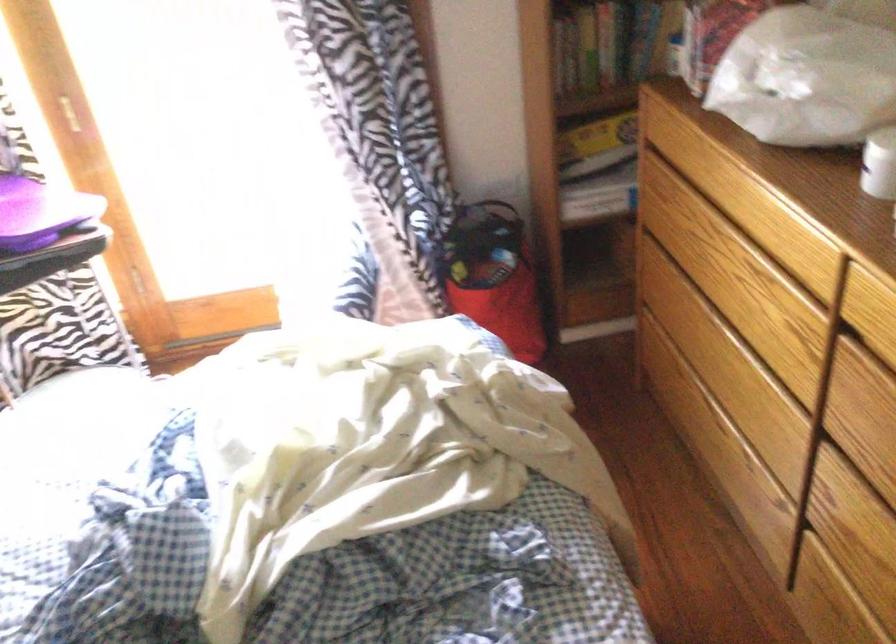
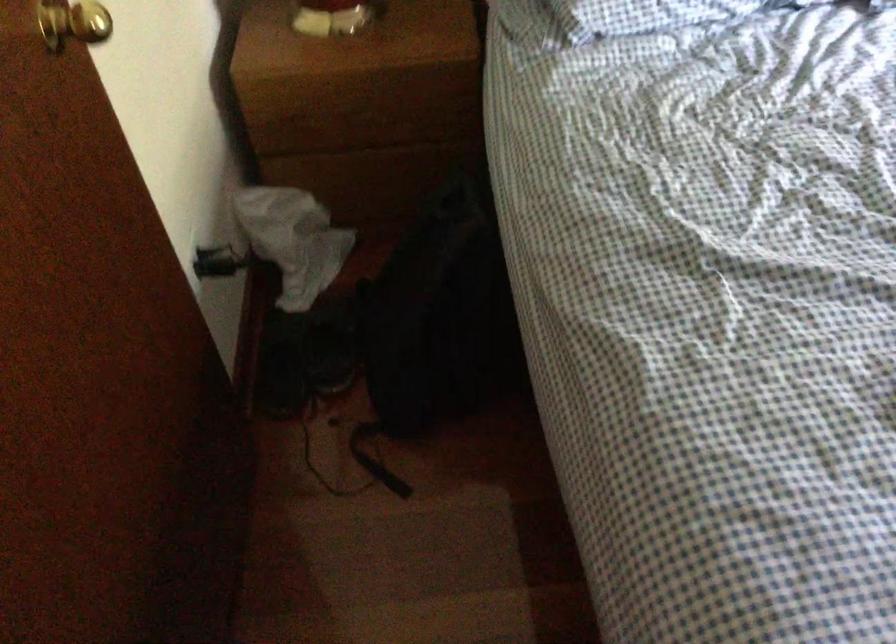
The images are taken continuously from a first-person perspective. In which direction is your viewpoint rotating?

The camera rotated toward left-down.